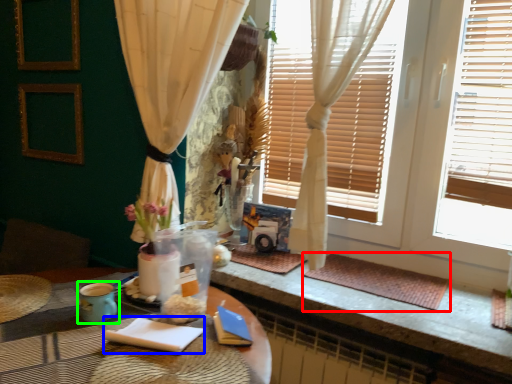
Question: Which object is positioned farthest from wide (highlighted by a red box)? Select from notepad (highlighted by a blue box) and teal (highlighted by a green box).

Choices:
 (A) notepad
 (B) teal

Answer: (B)